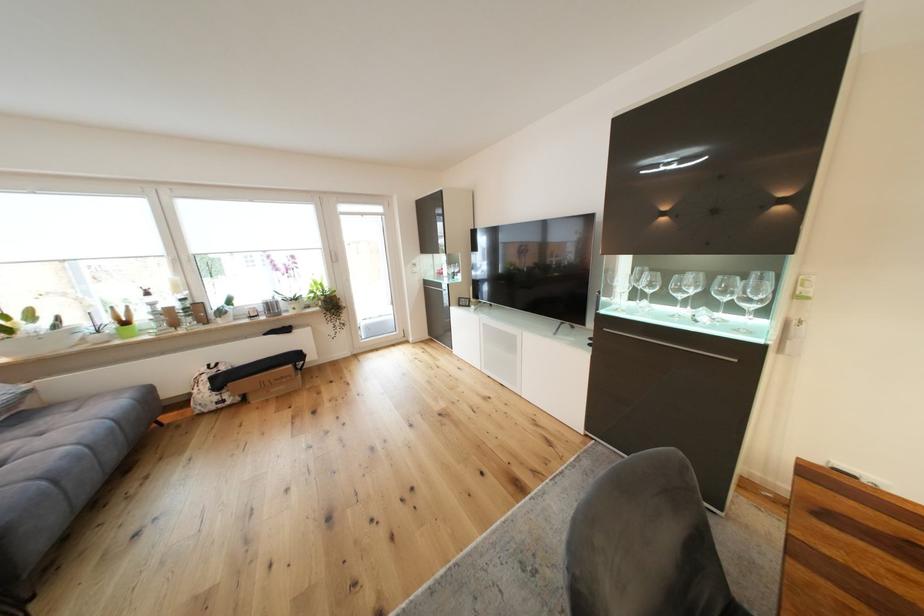
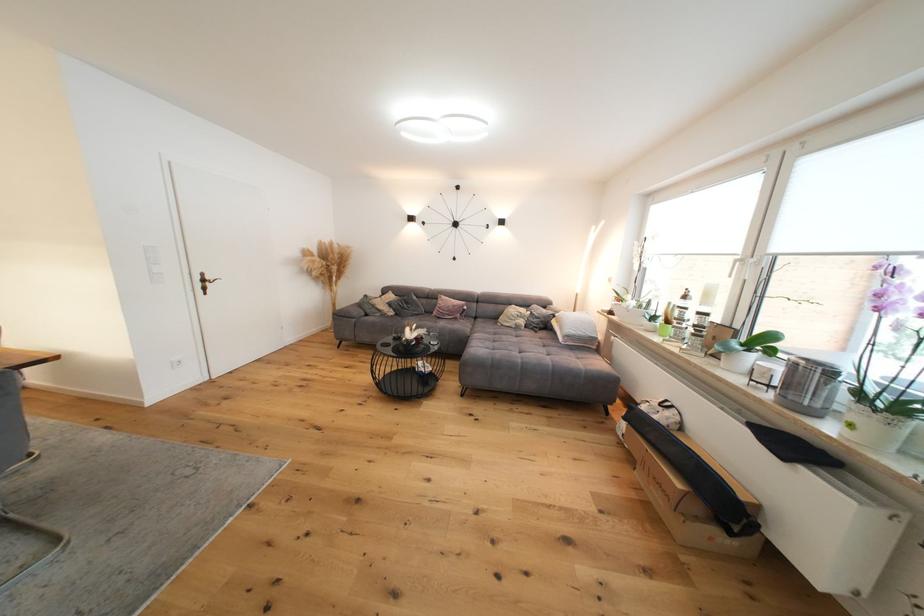
Where in the second image is the point corresponding to point 297,368 from the first image?

(687, 488)